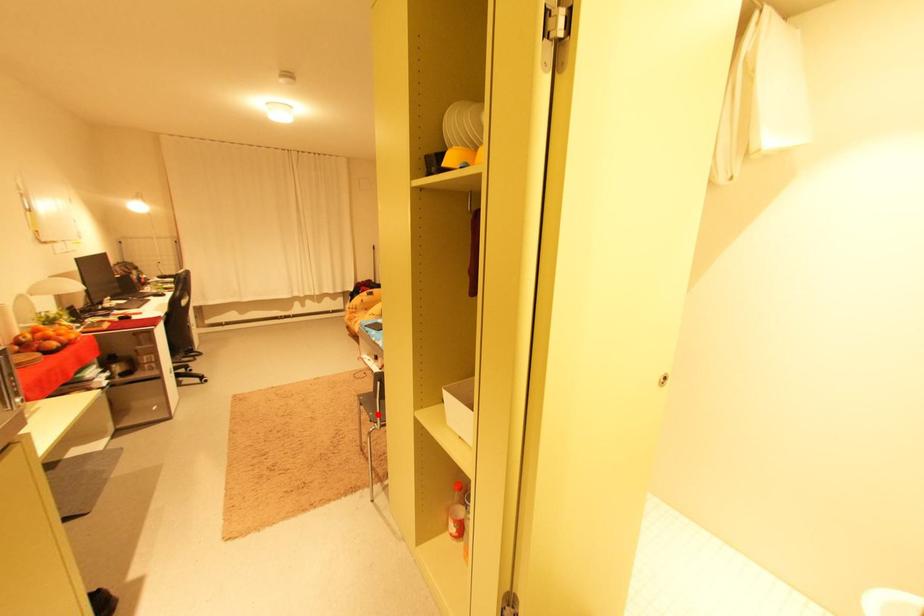
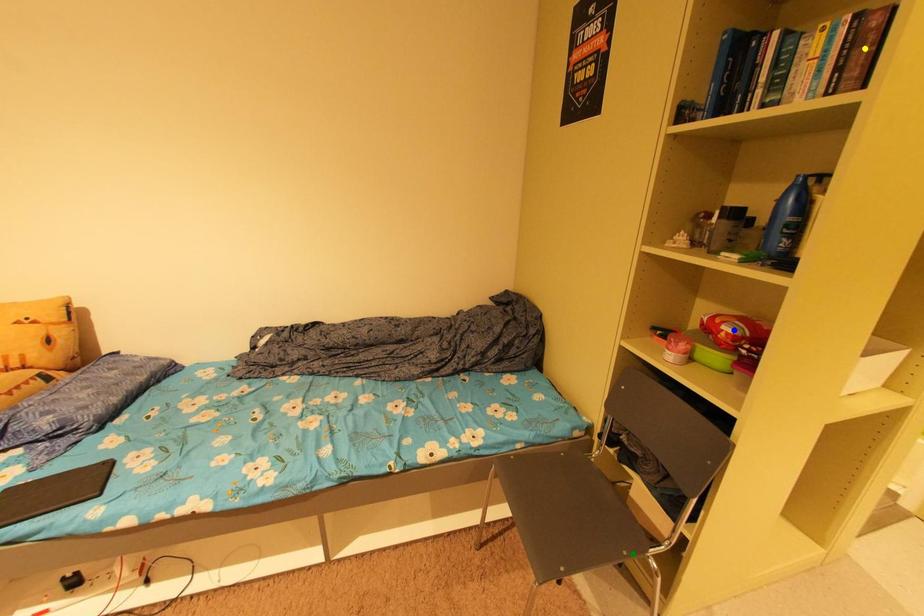
Question: I am providing you with two images of the same scene from different viewpoints. A red point is marked on the first image. You are given multiple points on the second image. Which point in image 2 is actually the same real-world point as the red point in image 1?

Choices:
 (A) green point
 (B) yellow point
 (C) blue point

Answer: (A)